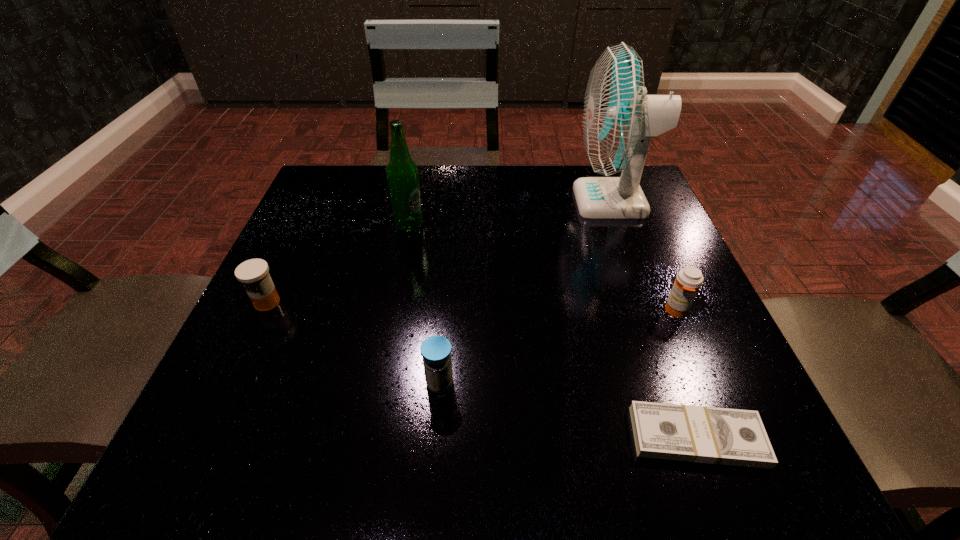
This screenshot has width=960, height=540. What are the coordinates of `free region at the far left corner of the desktop` in the screenshot? It's located at (357, 170).

Where is `vacant space at the near left corner of the desktop`? The height and width of the screenshot is (540, 960). vacant space at the near left corner of the desktop is located at coordinates (223, 472).

Locate an element on the screen. free point at the far right corner is located at coordinates (600, 219).

At what (x,y) coordinates should I click in order to perform the action: click on free spot between the leftmost object and the fifth object from right to left. Please return your answer as a coordinate pair (x, y). This screenshot has width=960, height=540. Looking at the image, I should click on (x=338, y=264).

What are the coordinates of `vacant area that lies between the leftmost object and the tallest object` in the screenshot? It's located at (440, 252).

Locate an element on the screen. The image size is (960, 540). free area in between the tallest object and the rightmost medicine is located at coordinates (644, 256).

This screenshot has width=960, height=540. I want to click on free space between the nearest object and the leftmost medicine, so click(x=482, y=369).

I want to click on free space that is in between the beer bottle and the nearest object, so click(x=553, y=331).

Where is `vacant area that lies between the leftmost medicine and the rightmost medicine`? The width and height of the screenshot is (960, 540). vacant area that lies between the leftmost medicine and the rightmost medicine is located at coordinates [x=472, y=306].

This screenshot has width=960, height=540. What are the coordinates of `unoccupied position between the leftmost object and the fan` in the screenshot? It's located at (440, 252).